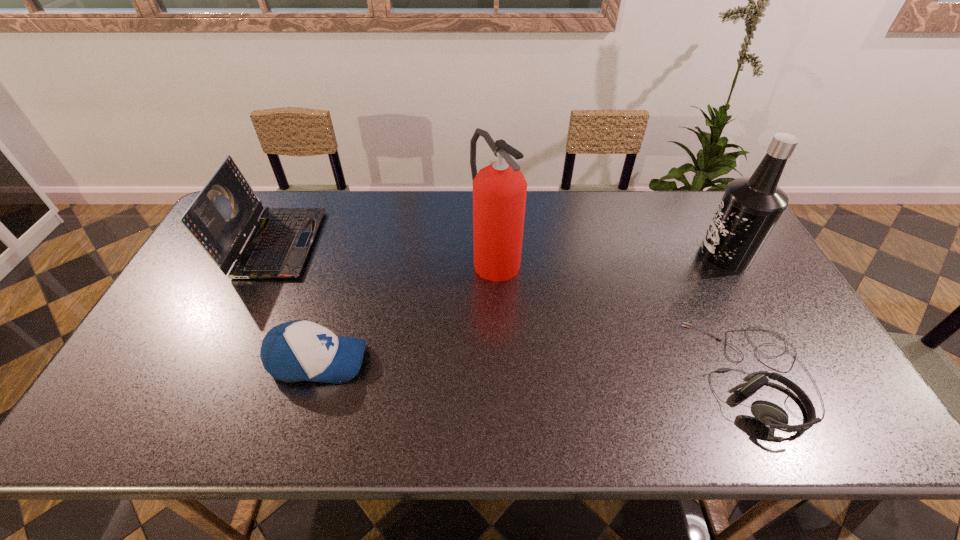
Where is `fire extinguisher`? fire extinguisher is located at coordinates (499, 190).

What are the coordinates of `liquor` in the screenshot? It's located at (750, 207).

Where is `the leftmost object`? The width and height of the screenshot is (960, 540). the leftmost object is located at coordinates (222, 216).

The width and height of the screenshot is (960, 540). Identify the location of laptop computer. (222, 216).

The image size is (960, 540). Identify the location of baseball cap. (300, 350).

Find the location of a particular element. The height and width of the screenshot is (540, 960). the fourth tallest object is located at coordinates (300, 350).

The height and width of the screenshot is (540, 960). I want to click on the shortest object, so click(773, 416).

Where is `blank area located on the handle side of the third object from right to left`? The width and height of the screenshot is (960, 540). blank area located on the handle side of the third object from right to left is located at coordinates (497, 310).

This screenshot has width=960, height=540. I want to click on free point located on the front label of the liquor, so click(x=636, y=258).

The height and width of the screenshot is (540, 960). I want to click on vacant area situated 0.070m on the front label of the liquor, so click(x=676, y=258).